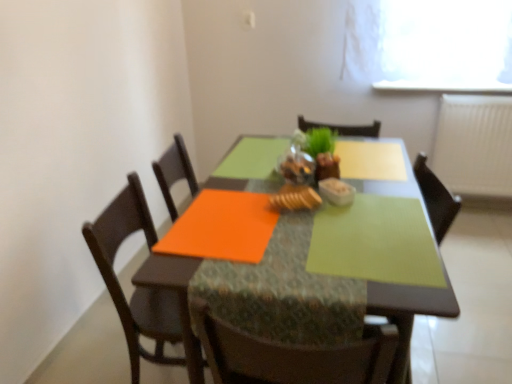
Locate an element on the screen. Image resolution: width=512 pixels, height=384 pixels. vacant area that lies to the right of white glossy bowl at center is located at coordinates (386, 197).